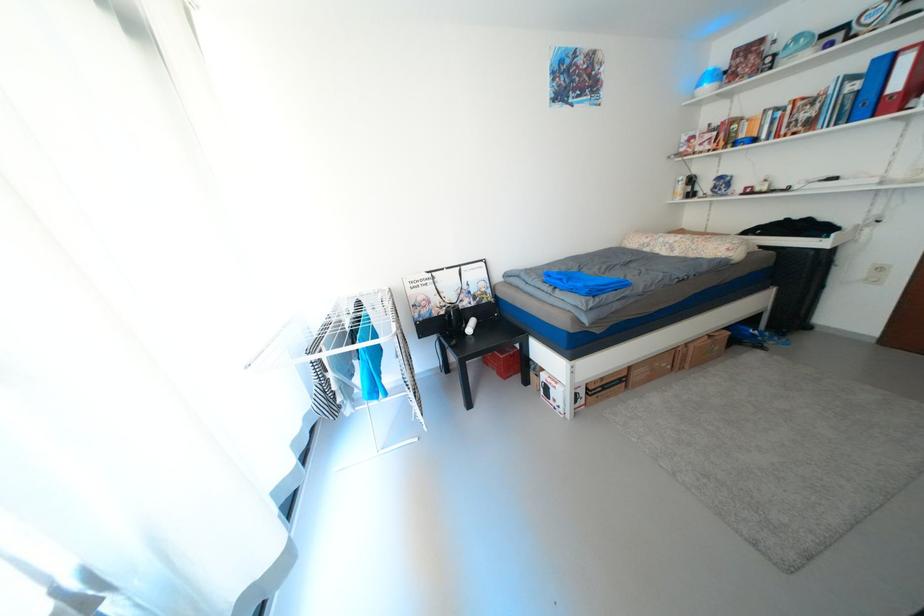
I want to click on white roll-on bottle, so click(x=469, y=326).